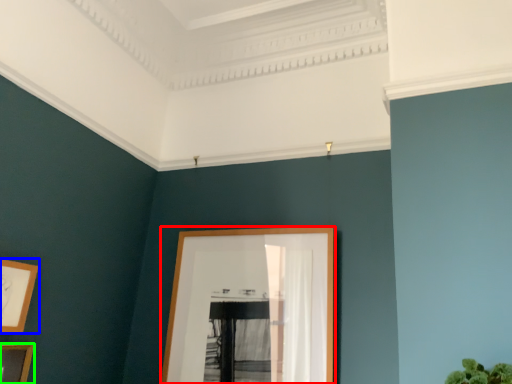
Question: Estimate the real-world distances between objects in this image. Which object is closer to picture frame (highlighted by a red box), picture frame (highlighted by a blue box) or picture frame (highlighted by a green box)?

Choices:
 (A) picture frame
 (B) picture frame

Answer: (A)